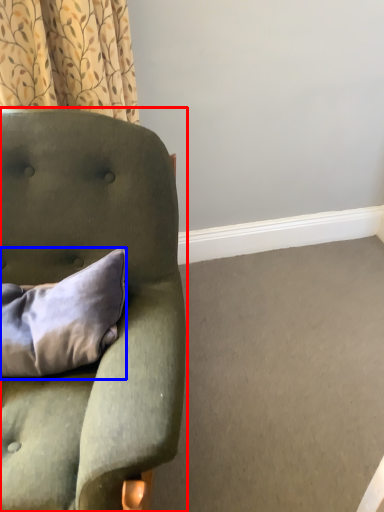
Question: Which object appears farthest to the camera in this image, chair (highlighted by a red box) or pillow (highlighted by a blue box)?

Choices:
 (A) chair
 (B) pillow

Answer: (B)